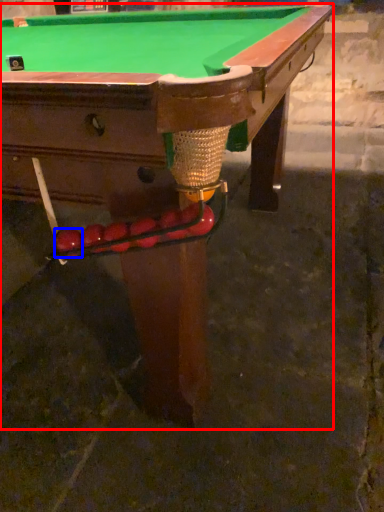
Question: Which of the following is the farthest to the observer, billiard table (highlighted by a red box) or fruit (highlighted by a blue box)?

Choices:
 (A) billiard table
 (B) fruit

Answer: (B)